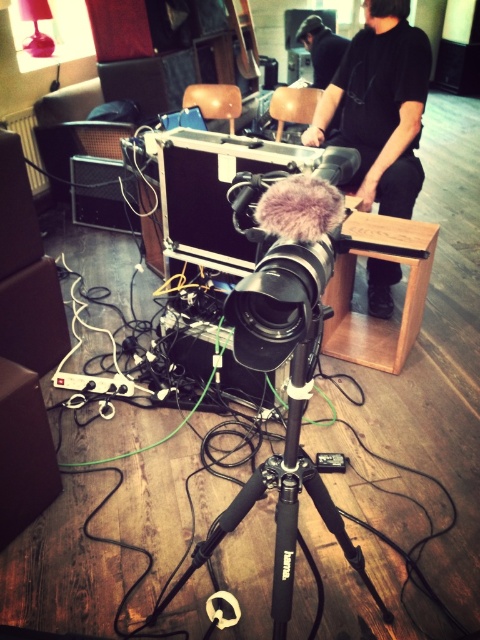
How distant is black matte shirt at center from black fabric shirt at upper center?

A distance of 6.19 feet exists between black matte shirt at center and black fabric shirt at upper center.

Does black matte shirt at center have a lesser height compared to black fabric shirt at upper center?

No.

Between point (361, 52) and point (314, 83), which one is positioned behind?

Point (314, 83)

This screenshot has width=480, height=640. What are the coordinates of `black matte shirt at center` in the screenshot? It's located at (380, 106).

In the scene shown: Does black matte camera at center lie behind black fabric shirt at upper center?

No, black matte camera at center is closer to the viewer.

The height and width of the screenshot is (640, 480). Describe the element at coordinates (286, 269) in the screenshot. I see `black matte camera at center` at that location.

Between point (296, 189) and point (322, 65), which one is positioned behind?

The point (322, 65) is more distant.

Locate an element on the screen. This screenshot has width=480, height=640. black matte camera at center is located at coordinates (286, 269).

What do you see at coordinates (380, 106) in the screenshot? This screenshot has height=640, width=480. I see `black matte shirt at center` at bounding box center [380, 106].

Who is more distant from viewer, (408, 141) or (282, 592)?

The point (408, 141) is more distant.

In order to click on black matte shirt at center in this screenshot , I will do `click(380, 106)`.